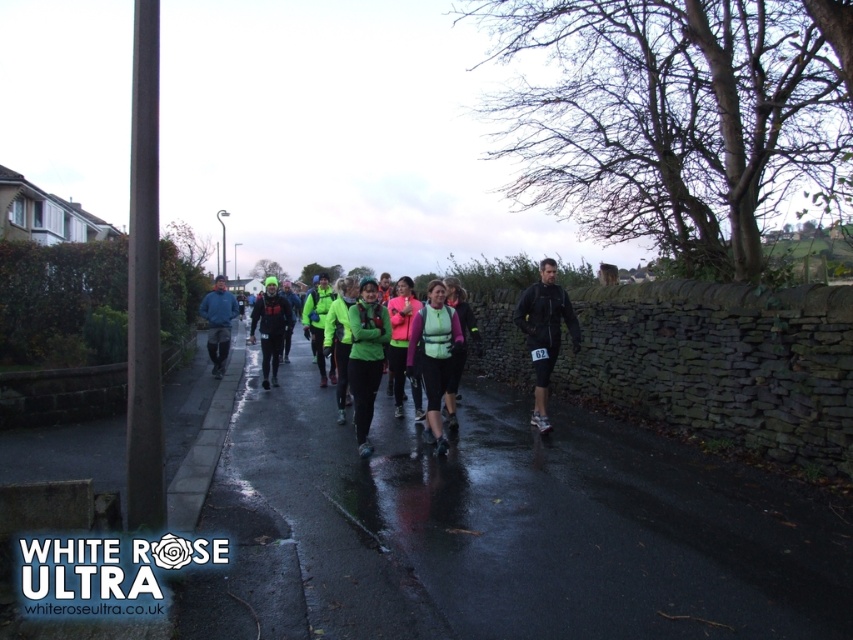
Looking at this image, who is shorter, matte black jacket at center or green matte vest at center?

green matte vest at center is shorter.

Who is more forward, (556, 304) or (440, 442)?

Point (440, 442) is more forward.

Identify the location of matte black jacket at center. The image size is (853, 640). (544, 332).

Between point (412, 388) and point (225, 348), which one is positioned in front?

Point (412, 388) is more forward.

Image resolution: width=853 pixels, height=640 pixels. What are the coordinates of `green fabric jacket at center` in the screenshot? It's located at (399, 337).

Who is more forward, (395, 394) or (227, 292)?

Point (395, 394) is more forward.

Where is `green fabric jacket at center`? This screenshot has width=853, height=640. green fabric jacket at center is located at coordinates (399, 337).

Does wet asphalt pavement at center appear under green fabric jacket at center?

Yes.

Does point (564, 556) come behind point (399, 385)?

No, (564, 556) is in front of (399, 385).

Where is `wet asphalt pavement at center`? This screenshot has width=853, height=640. wet asphalt pavement at center is located at coordinates (503, 531).